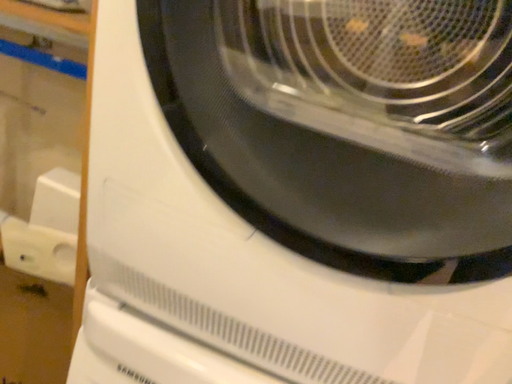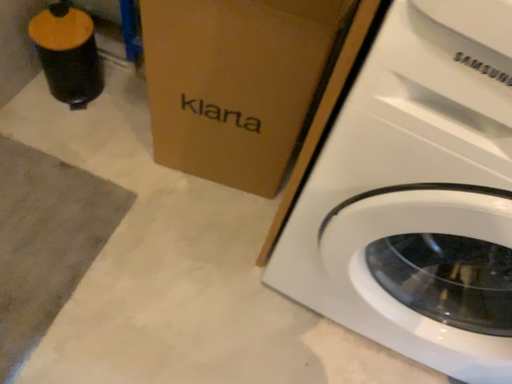
Question: How did the camera likely rotate when shooting the video?

Choices:
 (A) rotated left
 (B) rotated right

Answer: (A)